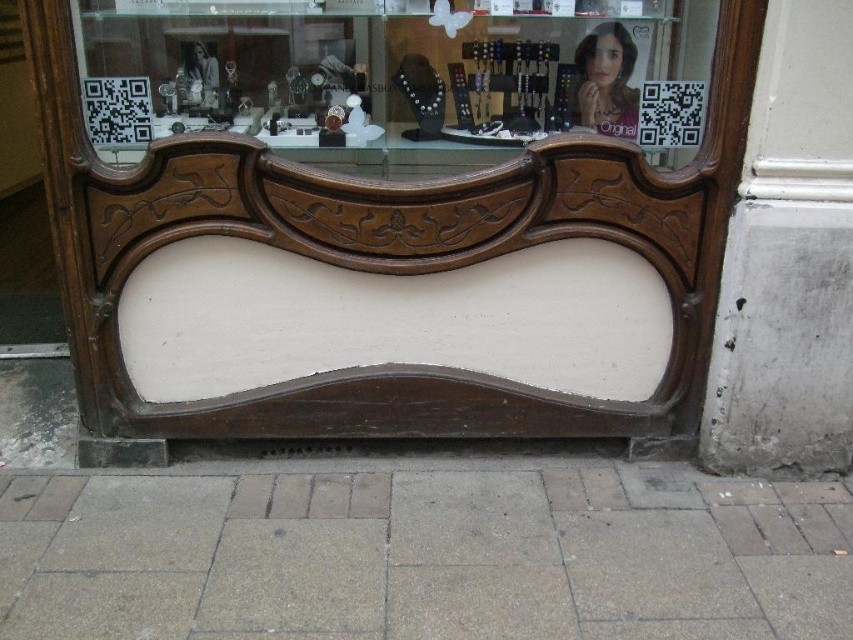
Question: Which point is farther to the camera?

Choices:
 (A) (167, 131)
 (B) (560, 480)
 (C) (582, 56)

Answer: (B)

Question: Does wooden carved frame at center appear under smooth skin face at upper right?

Choices:
 (A) yes
 (B) no

Answer: (A)

Question: Is gray concrete pavement at lower center bigger than wooden carved frame at center?

Choices:
 (A) yes
 (B) no

Answer: (A)

Question: Which object is closer to the camera taking this photo?

Choices:
 (A) gray concrete pavement at lower center
 (B) wooden carved frame at center
 (C) smooth skin face at upper right

Answer: (A)

Question: Among these objects, which one is farthest from the camera?

Choices:
 (A) wooden carved frame at center
 (B) smooth skin face at upper right
 (C) gray concrete pavement at lower center

Answer: (B)

Question: Does gray concrete pavement at lower center have a larger size compared to smooth skin face at upper right?

Choices:
 (A) no
 (B) yes

Answer: (B)